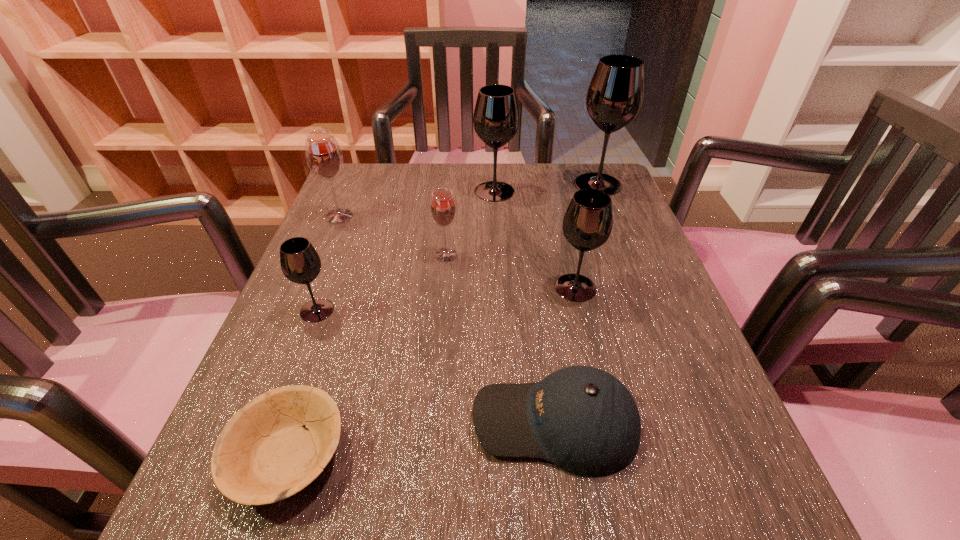
This screenshot has height=540, width=960. In order to click on vacant space located on the front-facing side of the baseball cap in this screenshot , I will do `click(412, 422)`.

The image size is (960, 540). In order to click on free spot located 0.170m on the front-facing side of the baseball cap in this screenshot , I will do `click(358, 422)`.

This screenshot has width=960, height=540. Find the location of `free space located 0.300m on the front-facing side of the baseball cap`. free space located 0.300m on the front-facing side of the baseball cap is located at coordinates (271, 422).

The height and width of the screenshot is (540, 960). I want to click on vacant space located on the right of the bowl, so click(x=563, y=456).

This screenshot has height=540, width=960. Find the location of `object located in the near edge section of the desktop`. object located in the near edge section of the desktop is located at coordinates [263, 455].

This screenshot has height=540, width=960. In order to click on bowl located at the left edge in this screenshot , I will do `click(263, 455)`.

Locate an element on the screen. baseball cap that is at the right edge is located at coordinates 584,420.

Where is `object present at the far left corner`? Image resolution: width=960 pixels, height=540 pixels. object present at the far left corner is located at coordinates (323, 154).

Find the location of `object positioned at the near left corner`. object positioned at the near left corner is located at coordinates (263, 455).

At what (x,y) coordinates should I click in order to perform the action: click on object present at the far right corner. Please return your answer as a coordinate pair (x, y). Looking at the image, I should click on (615, 95).